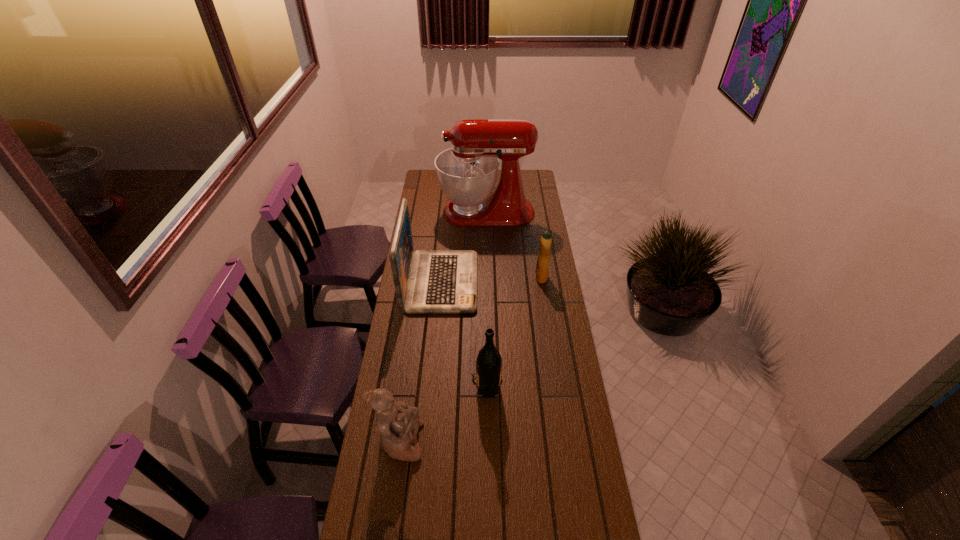
At what (x,y) coordinates should I click in order to perform the action: click on the farthest object. Please return your answer as a coordinate pair (x, y). Looking at the image, I should click on (467, 172).

Locate an element on the screen. This screenshot has height=540, width=960. mixer is located at coordinates (467, 172).

Where is `laptop computer`? Image resolution: width=960 pixels, height=540 pixels. laptop computer is located at coordinates (426, 281).

Locate an element on the screen. This screenshot has height=540, width=960. the fourth farthest object is located at coordinates (488, 376).

You are a GUI agent. You are given a task and a screenshot of the screen. Output one action in this format:
    pyautogui.click(x=<x>, y=<y>)
    Task: Click on the figurine
    This screenshot has width=960, height=540.
    Given the screenshot: What is the action you would take?
    pyautogui.click(x=398, y=423)

Locate an element on the screen. The height and width of the screenshot is (540, 960). detergent is located at coordinates (542, 264).

This screenshot has height=540, width=960. In order to click on vacant space located 0.050m at the attachment hub of the mixer in this screenshot , I will do `click(429, 212)`.

This screenshot has height=540, width=960. What are the coordinates of `vacant space located 0.110m on the screen of the laptop computer` in the screenshot? It's located at (501, 282).

Where is `vacant space located on the back of the wine bottle`? This screenshot has width=960, height=540. vacant space located on the back of the wine bottle is located at coordinates (486, 339).

Where is `free space located on the front-facing side of the figurine`? The width and height of the screenshot is (960, 540). free space located on the front-facing side of the figurine is located at coordinates (522, 441).